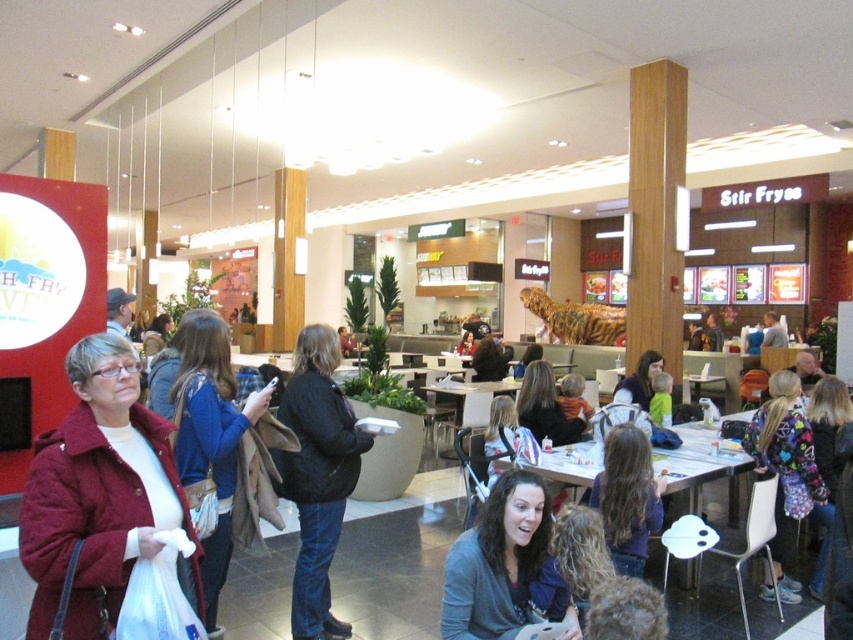
From the picture: You are a photographer setting up a shoot in the food court. You need to position a 1.2 meter tall mannequin between the black matte jacket at center and the multicolored fleece jacket at lower right. Can the mannequin fit vertically between them without overlapping either?

The black matte jacket at center is taller than the multicolored fleece jacket at lower right. Since the mannequin is 1.2 meters tall, it can fit vertically between them as long as the space between their heights allows. However, the exact vertical clearance isn

You are a photographer positioned at the entrance of the food court and want to take a photo that includes both the black matte jacket at center and the dark gray sweater at center. Which of the two objects will appear closer to the camera in the final photo?

The black matte jacket at center will appear closer to the camera in the photo because it is positioned further to the viewer than the dark gray sweater at center.

You are a photographer taking a picture of the maroon coat at left and the blue fabric jacket at left. Which one appears shorter in the photo?

The maroon coat at left appears shorter because it has a lesser height compared to the blue fabric jacket at left.